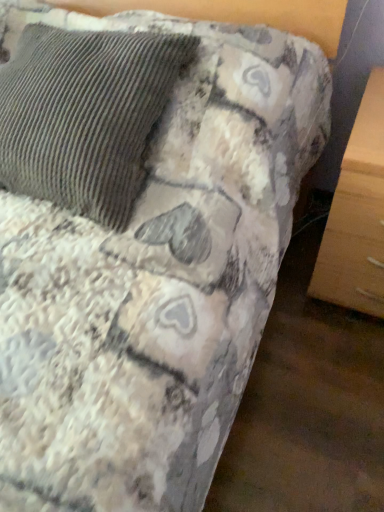
At what (x,y) coordinates should I click in order to perform the action: click on vacant area that is in front of light wood drawer at lower right. Please return your answer as a coordinate pair (x, y). The width and height of the screenshot is (384, 512). Looking at the image, I should click on (332, 366).